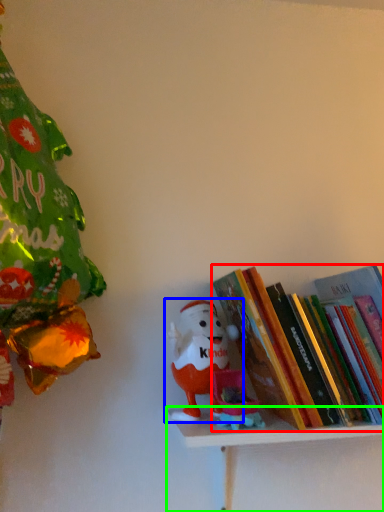
Question: Which object is the farthest from book (highlighted by a red box)? Choose among these: toy (highlighted by a blue box) or shelf (highlighted by a green box).

Choices:
 (A) toy
 (B) shelf

Answer: (A)